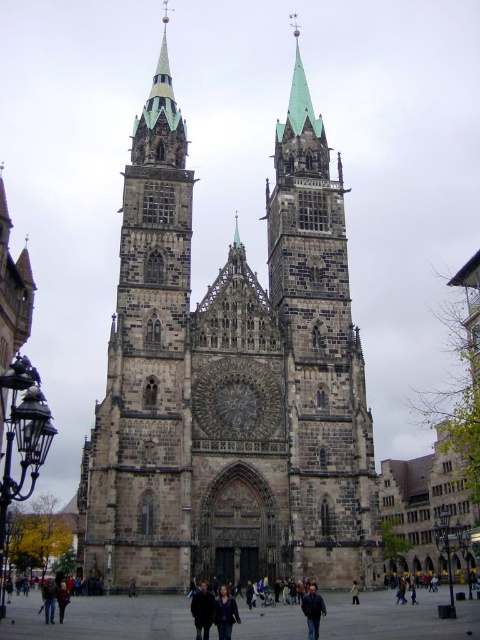
Is stone gothic cathedral at center above yellow fabric person at center?

Yes, stone gothic cathedral at center is above yellow fabric person at center.

You are a GUI agent. You are given a task and a screenshot of the screen. Output one action in this format:
    pyautogui.click(x=<x>, y=<y>)
    Task: Click on the stone gothic cathedral at center
    
    Given the screenshot: What is the action you would take?
    pyautogui.click(x=225, y=356)

Where is `stone gothic cathedral at center`? The image size is (480, 640). stone gothic cathedral at center is located at coordinates (225, 356).

From the picture: Which is more to the left, dark brown stone clock at center or yellow fabric person at center?

dark brown stone clock at center is more to the left.

Where is `dark brown stone clock at center`? dark brown stone clock at center is located at coordinates [237, 400].

In order to click on dark brown stone clock at center in this screenshot , I will do `click(237, 400)`.

Between dark blue jeans at lower center and yellow fabric person at center, which one appears on the right side from the viewer's perspective?

From the viewer's perspective, yellow fabric person at center appears more on the right side.

Measure the distance between point (315, 627) and camera.

49.30 meters

Is point (313, 620) positioned in front of point (350, 595)?

Yes, point (313, 620) is closer to viewer.

Find the location of a particular element. Image resolution: width=480 pixels, height=640 pixels. dark blue jeans at lower center is located at coordinates (312, 611).